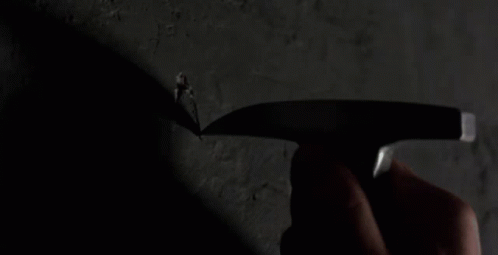
Locate an element on the screen. This screenshot has height=255, width=498. wall is located at coordinates (310, 49).